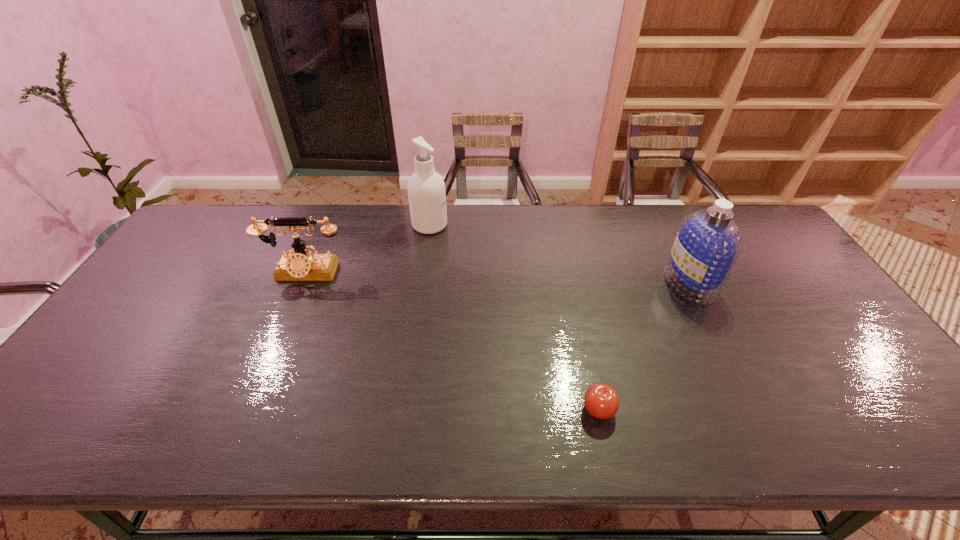
Find the location of a particular element. The height and width of the screenshot is (540, 960). free space between the apple and the leftmost object is located at coordinates (452, 341).

Locate an element on the screen. The width and height of the screenshot is (960, 540). vacant area that lies between the farther cleansing agent and the nearer cleansing agent is located at coordinates (560, 254).

At what (x,y) coordinates should I click in order to perform the action: click on empty location between the nearer cleansing agent and the leftmost object. Please return your answer as a coordinate pair (x, y). The width and height of the screenshot is (960, 540). Looking at the image, I should click on (497, 278).

Image resolution: width=960 pixels, height=540 pixels. Identify the location of vacant space in between the left cleansing agent and the apple. (515, 317).

This screenshot has height=540, width=960. What are the coordinates of `free space that is in between the telephone and the farthest object` in the screenshot? It's located at (368, 248).

Where is `vacant point located between the second object from right to left and the third tallest object`? The height and width of the screenshot is (540, 960). vacant point located between the second object from right to left and the third tallest object is located at coordinates coord(452,341).

The image size is (960, 540). I want to click on vacant space that's between the shortest object and the left cleansing agent, so click(x=515, y=317).

Image resolution: width=960 pixels, height=540 pixels. In order to click on vacant region between the nearer cleansing agent and the telephone in this screenshot , I will do `click(497, 278)`.

This screenshot has width=960, height=540. I want to click on vacant region between the right cleansing agent and the farther cleansing agent, so click(560, 254).

You are a GUI agent. You are given a task and a screenshot of the screen. Output one action in this format:
    pyautogui.click(x=<x>, y=<y>)
    Task: Click on the object that is the closest to the third tallest object
    
    Given the screenshot: What is the action you would take?
    pyautogui.click(x=426, y=190)